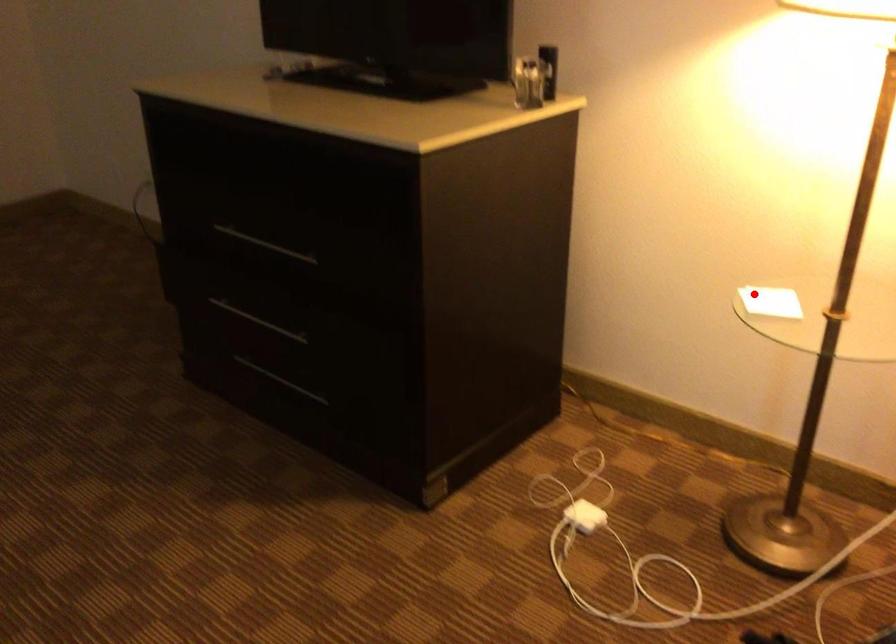
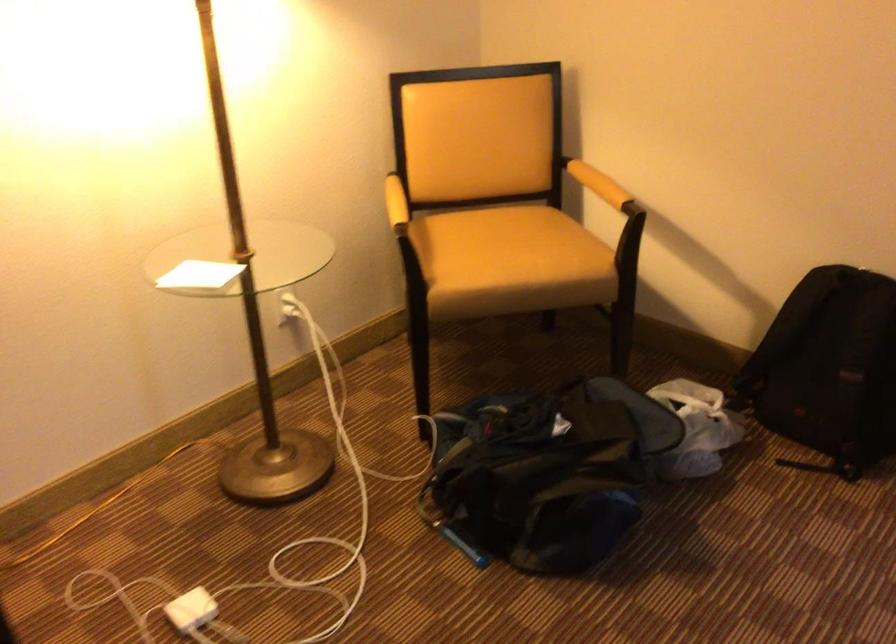
In the second image, find the point that corresponds to the highlighted location in the first image.

(199, 275)